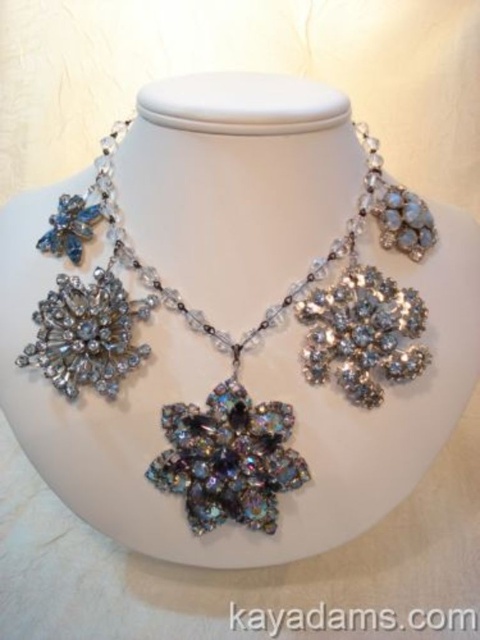
You are an appraiser examining the necklace displayed on the mannequin. You need to determine the spatial relationship between the iridescent crystal necklace at center and the iridescent crystal flower at lower left. From the perspective of someone facing the mannequin, which object is positioned to the right?

The iridescent crystal necklace at center is to the right of the iridescent crystal flower at lower left, so the iridescent crystal necklace at center is positioned to the right.

You are an appraiser examining a necklace. You have to determine if the iridescent crystal necklace at center can fit into a display case that is only wide enough for items narrower than the iridescent crystal flower at lower left. Can the necklace fit?

The iridescent crystal necklace at center is wider than the iridescent crystal flower at lower left. Therefore, it cannot fit into the display case designed for items narrower than the iridescent crystal flower at lower left.